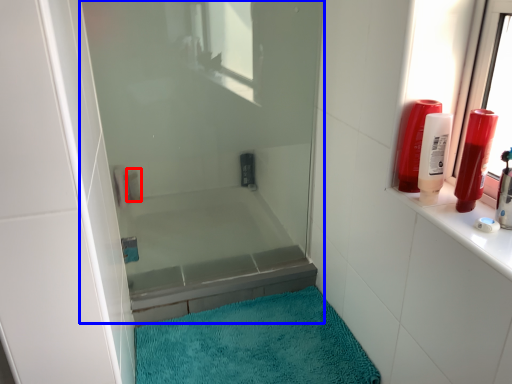
Question: Which of the following is the farthest to the observer, toiletry (highlighted by a red box) or shower door (highlighted by a blue box)?

Choices:
 (A) toiletry
 (B) shower door

Answer: (A)